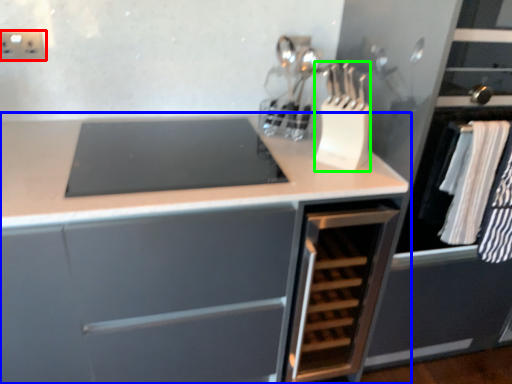
Question: Estimate the real-world distances between objects in this image. Which object is farther from electric outlet (highlighted by a red box), cabinetry (highlighted by a blue box) or kitchen appliance (highlighted by a green box)?

Choices:
 (A) cabinetry
 (B) kitchen appliance

Answer: (B)